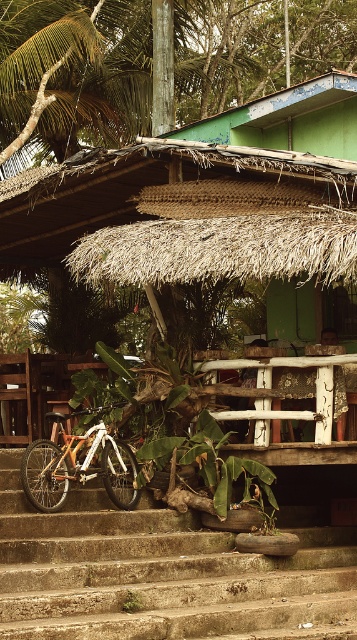
Is thatched roof hut at center bigger than concrete stairs at lower center?

Yes.

Is thatched roof hut at center above concrete stairs at lower center?

Yes.

Is point (344, 147) positioned in front of point (18, 566)?

No, it is behind (18, 566).

I want to click on thatched roof hut at center, so click(x=208, y=204).

Can you confirm if thatched roof hut at center is bigger than orange matte bicycle at lower left?

Correct, thatched roof hut at center is larger in size than orange matte bicycle at lower left.

Which is behind, point (104, 202) or point (128, 445)?

The point (104, 202) is behind.

Between point (91, 237) and point (73, 474), which one is positioned behind?

The point (91, 237) is behind.

You are a GUI agent. You are given a task and a screenshot of the screen. Output one action in this format:
    pyautogui.click(x=<x>, y=<y>)
    Task: Click on the thatched roof hut at center
    Image resolution: width=357 pixels, height=640 pixels.
    Given the screenshot: What is the action you would take?
    pyautogui.click(x=208, y=204)

Does thatched roof hut at center appear on the left side of white wood balustrade at center?

Correct, you'll find thatched roof hut at center to the left of white wood balustrade at center.

Does point (354, 129) lie behind point (315, 417)?

Yes, point (354, 129) is farther from viewer.

Is point (7, 189) positioned behind point (320, 356)?

Yes.

Identify the location of thatched roof hut at center. (208, 204).